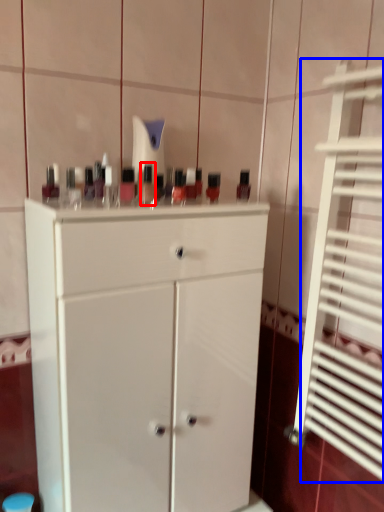
Question: Which point is closer to the camera, mouthwash (highlighted by a red box) or shutter (highlighted by a blue box)?

Choices:
 (A) mouthwash
 (B) shutter

Answer: (B)